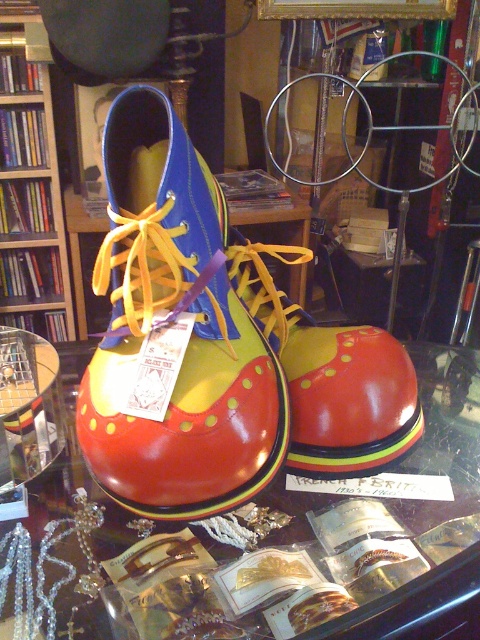
Looking at this image, you are standing in a store and want to pick up an item located at point (147, 152). Your hand can reach up to 40 centimeters. Can you reach the item without moving closer?

The point (147, 152) is 50.04 centimeters away from you, which is beyond your hand reach of 40 centimeters. You will need to move closer to reach it.

You are standing in a store and want to pick up an item located at point (323, 637). The store has a rule that you must stay at least 12 inches away from the items on display. Are you violating the store policy?

The distance between you and point (323, 637) is 15.23 inches, which is greater than the required 12 inches. Therefore, you are not violating the store policy.